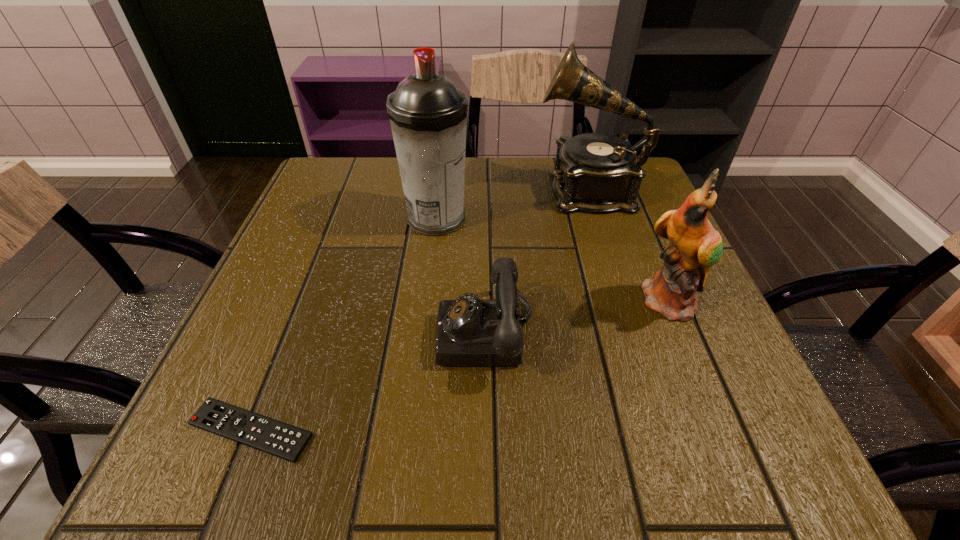
Identify the location of free space between the telephone and the aerosol can. (462, 276).

Where is `empty location between the remote control and the parrot`? The height and width of the screenshot is (540, 960). empty location between the remote control and the parrot is located at coordinates pyautogui.click(x=462, y=366).

I want to click on free point between the second shortest object and the aerosol can, so click(462, 276).

This screenshot has height=540, width=960. What are the coordinates of `free spot between the aerosol can and the parrot` in the screenshot? It's located at (555, 261).

Find the location of a particular element. vacant area that lies between the parrot and the aerosol can is located at coordinates (555, 261).

Find the location of a particular element. The height and width of the screenshot is (540, 960). empty space between the second shortest object and the phonograph record is located at coordinates (537, 262).

Identify the location of vacant area between the telephone and the aerosol can. Image resolution: width=960 pixels, height=540 pixels. (462, 276).

Identify the location of vacant point located between the second shortest object and the parrot. (579, 318).

This screenshot has width=960, height=540. Identify the location of vacant area between the aerosol can and the remote control. (344, 325).

Locate which object is the closest to the telephone. Please provide its 2D coordinates. Your answer should be formatted as a tuple, i.e. [(x, y)], where the tuple contains the x and y coordinates of a point satisfying the conditions above.

[(428, 114)]